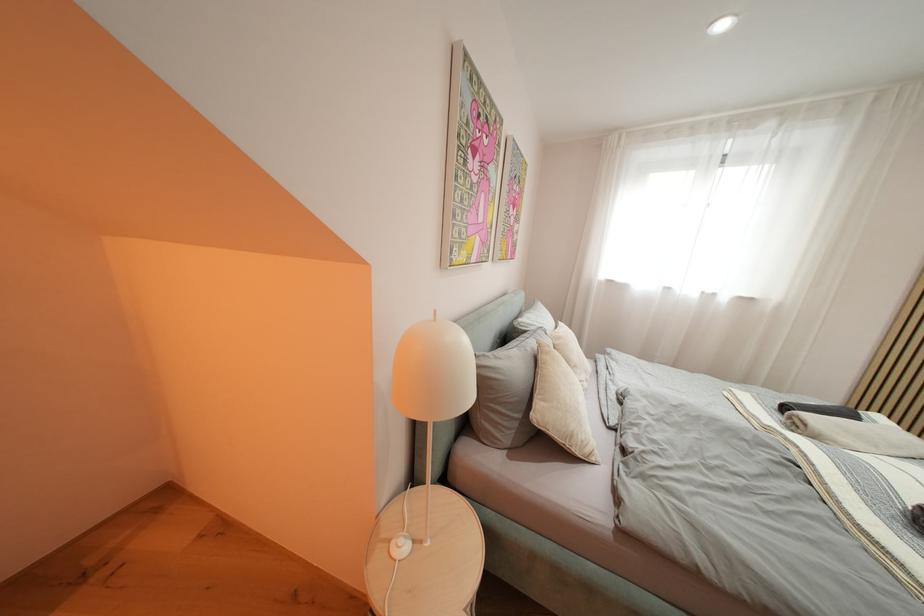
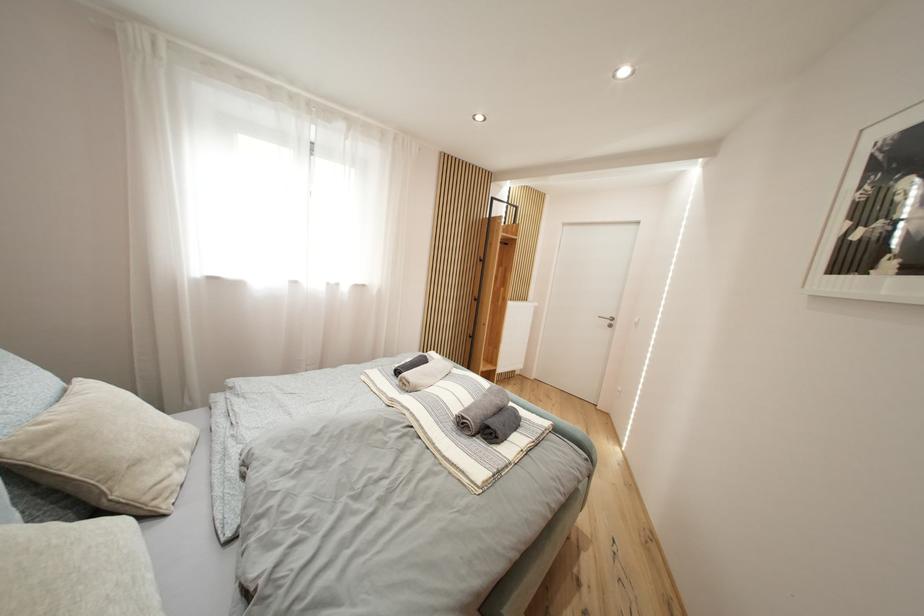
Question: The first image is from the beginning of the video and the second image is from the end. How did the camera likely rotate when shooting the video?

Choices:
 (A) Left
 (B) Right
 (C) Up
 (D) Down

Answer: (B)